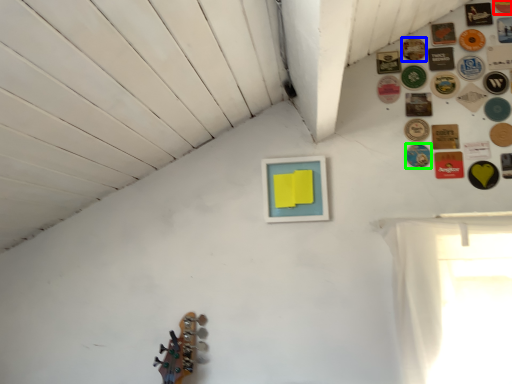
Question: Which object is the farthest from button (highlighted by a red box)? Choose among these: button (highlighted by a blue box) or button (highlighted by a green box).

Choices:
 (A) button
 (B) button

Answer: (B)